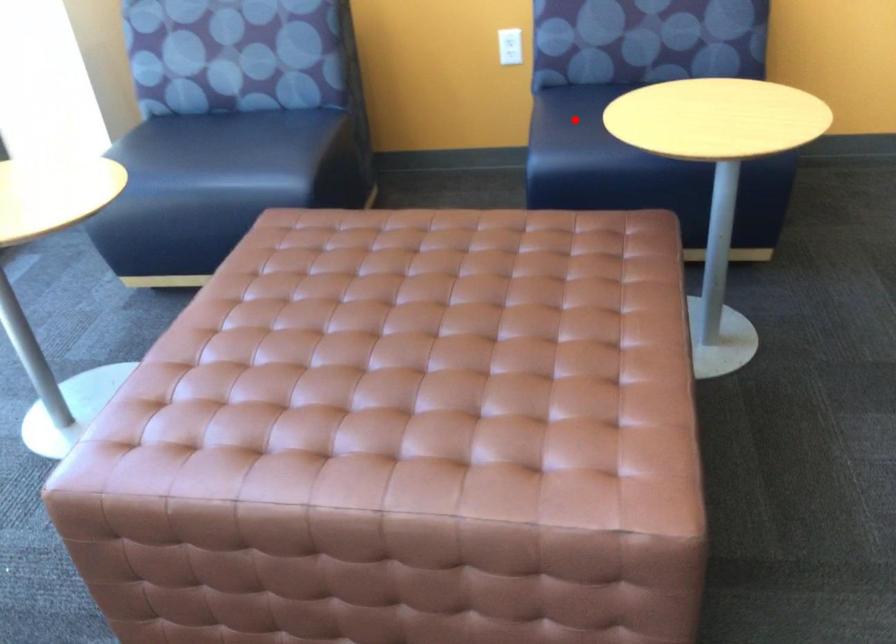
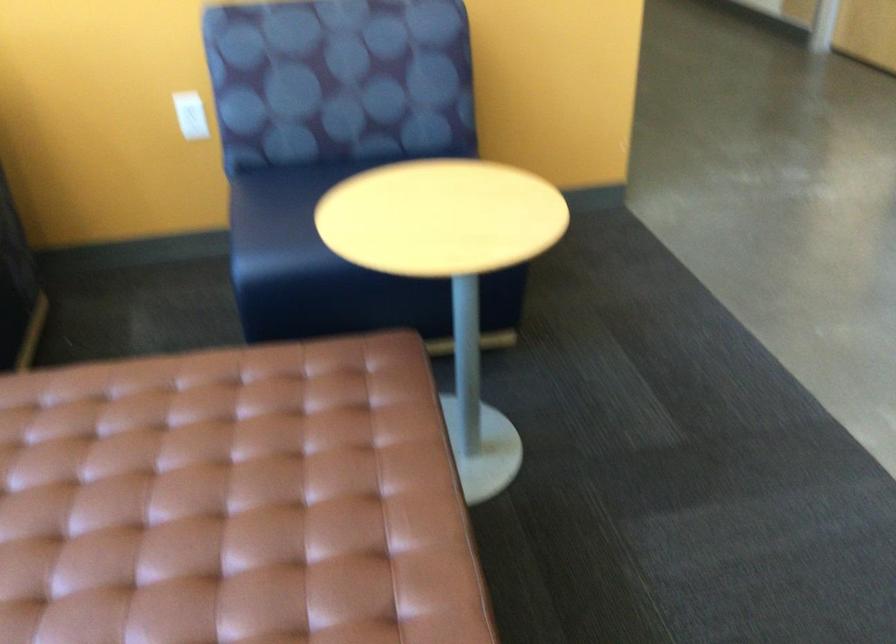
Question: I am providing you with two images of the same scene from different viewpoints. Given a red point in image1, look at the same physical point in image2. Is it:

Choices:
 (A) Closer to the viewpoint
 (B) Farther from the viewpoint

Answer: (A)